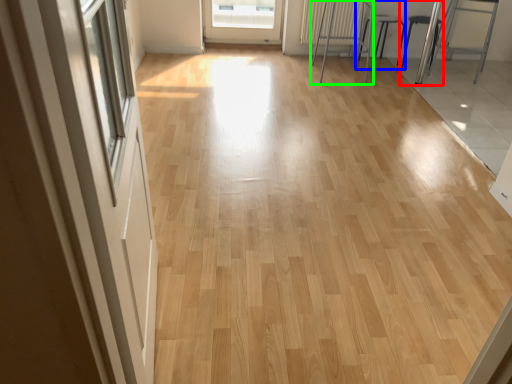
Question: Which is nearer to the armchair (highlighted by a red box)? armchair (highlighted by a blue box) or furniture (highlighted by a green box).

Choices:
 (A) armchair
 (B) furniture

Answer: (A)